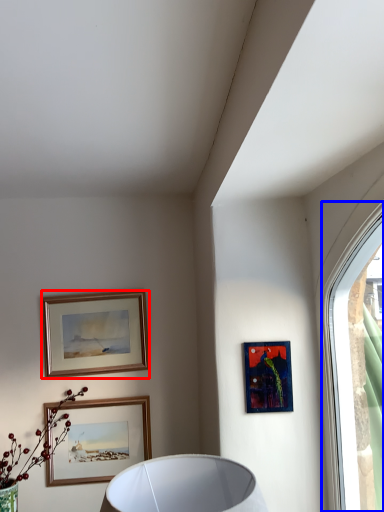
Question: Which of the following is the farthest to the observer, picture frame (highlighted by a red box) or window (highlighted by a blue box)?

Choices:
 (A) picture frame
 (B) window

Answer: (A)